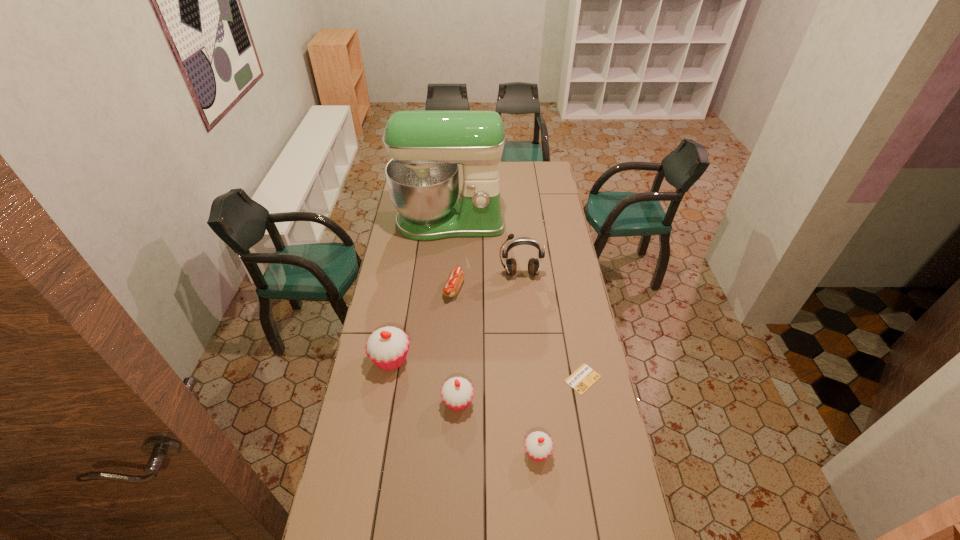
This screenshot has height=540, width=960. What are the coordinates of `free spot between the sausage and the second nearest cupcake` in the screenshot? It's located at (456, 346).

The image size is (960, 540). I want to click on free space between the second shortest object and the rightmost object, so click(x=518, y=334).

Locate an element on the screen. free spot between the second farthest cupcake and the earphone is located at coordinates (490, 338).

Where is `empty space between the farthest cupcake and the second tallest object`? The height and width of the screenshot is (540, 960). empty space between the farthest cupcake and the second tallest object is located at coordinates (455, 316).

This screenshot has height=540, width=960. Find the location of `blank region between the earphone and the shortest cupcake`. blank region between the earphone and the shortest cupcake is located at coordinates (529, 363).

Identify the location of vacant area that lies between the sausage and the earphone. (488, 281).

Locate which object ranks in proximity to the nearest cupcake. Please provide its 2D coordinates. Your answer should be formatted as a tuple, i.e. [(x, y)], where the tuple contains the x and y coordinates of a point satisfying the conditions above.

[(457, 393)]

At what (x,y) coordinates should I click in order to perform the action: click on the fourth closest object relative to the nearest object. Please return your answer as a coordinate pair (x, y). The image size is (960, 540). Looking at the image, I should click on (456, 277).

Locate an element on the screen. The image size is (960, 540). cupcake that is the second nearest to the second nearest cupcake is located at coordinates (538, 445).

Identify which cupcake is located as the second nearest to the earphone. Please provide its 2D coordinates. Your answer should be formatted as a tuple, i.e. [(x, y)], where the tuple contains the x and y coordinates of a point satisfying the conditions above.

[(457, 393)]